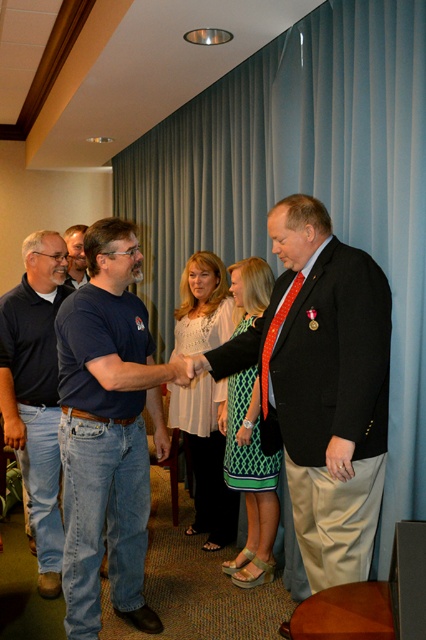
Is denim jeans at center positioned at the back of white lace blouse at center?

No.

Who is higher up, denim jeans at center or white lace blouse at center?

Positioned higher is white lace blouse at center.

What do you see at coordinates (108, 429) in the screenshot?
I see `denim jeans at center` at bounding box center [108, 429].

Locate an element on the screen. The width and height of the screenshot is (426, 640). denim jeans at center is located at coordinates (108, 429).

Which is in front, point (123, 300) or point (72, 282)?

Point (123, 300) is more forward.

Is denim jeans at center below matte black shirt at center?

Yes.

Describe the element at coordinates (108, 429) in the screenshot. I see `denim jeans at center` at that location.

Image resolution: width=426 pixels, height=640 pixels. Find the location of `denim jeans at center`. denim jeans at center is located at coordinates (108, 429).

Where is `blue fabric curtain at center`? The image size is (426, 640). blue fabric curtain at center is located at coordinates (305, 186).

Where is `blue fabric curtain at center`? The height and width of the screenshot is (640, 426). blue fabric curtain at center is located at coordinates (305, 186).

At what (x,y) coordinates should I click in order to perform the action: click on blue fabric curtain at center. Please return your answer as a coordinate pair (x, y). Looking at the image, I should click on (305, 186).